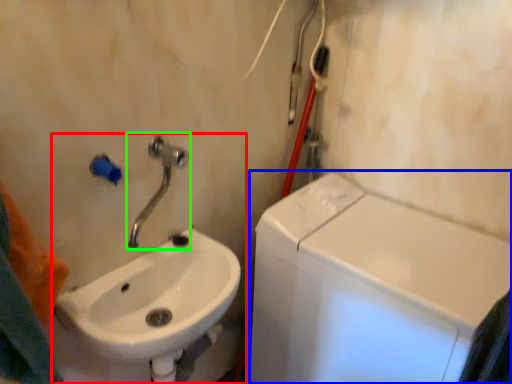
Question: Estimate the real-world distances between objects in this image. Which object is closer to sink (highlighted by a red box), washing machine (highlighted by a blue box) or tap (highlighted by a green box)?

Choices:
 (A) washing machine
 (B) tap

Answer: (B)